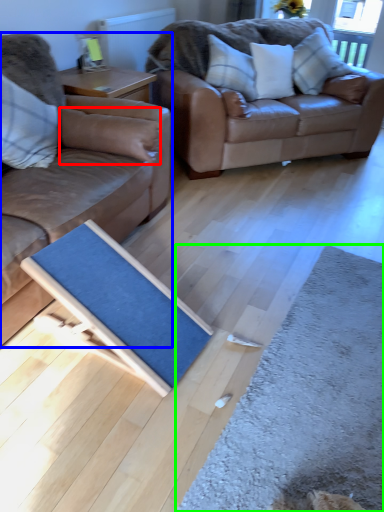
Question: Based on their relative distances, which object is farther from pillow (highlighted by a red box)? Choose from studio couch (highlighted by a blue box) and doormat (highlighted by a green box).

Choices:
 (A) studio couch
 (B) doormat

Answer: (B)